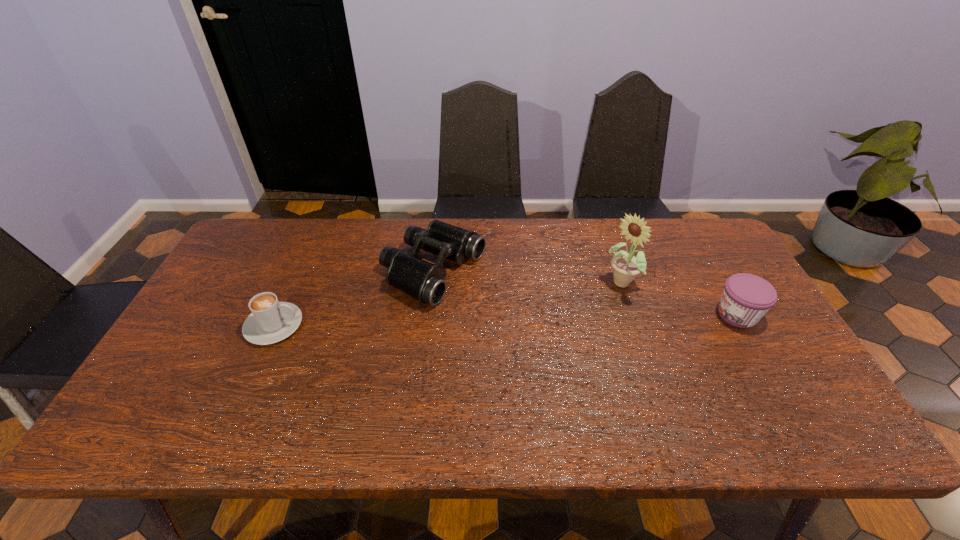
Locate an element on the screen. This screenshot has height=540, width=960. free space at the left edge is located at coordinates (229, 268).

Where is `free spot at the far left corner of the desktop`? free spot at the far left corner of the desktop is located at coordinates (254, 221).

This screenshot has width=960, height=540. What are the coordinates of `unoccupied position between the second object from left to right and the cappuccino` in the screenshot? It's located at (353, 299).

Find the location of a particular element. The width and height of the screenshot is (960, 540). blank region between the binoculars and the jam is located at coordinates (586, 293).

This screenshot has height=540, width=960. I want to click on free space between the jam and the cappuccino, so click(506, 320).

Identify the location of empty space between the leftmost object and the jam. (506, 320).

Where is `free point between the cappuccino and the binoculars`? This screenshot has width=960, height=540. free point between the cappuccino and the binoculars is located at coordinates coord(353,299).

Image resolution: width=960 pixels, height=540 pixels. What are the coordinates of `free space between the binoculars and the jam` in the screenshot? It's located at (586, 293).

The height and width of the screenshot is (540, 960). What are the coordinates of `vacant area that lies between the rightmost object and the sunflower` in the screenshot? It's located at (680, 299).

In order to click on blank region between the second object from right to left and the rightmost object in this screenshot , I will do `click(680, 299)`.